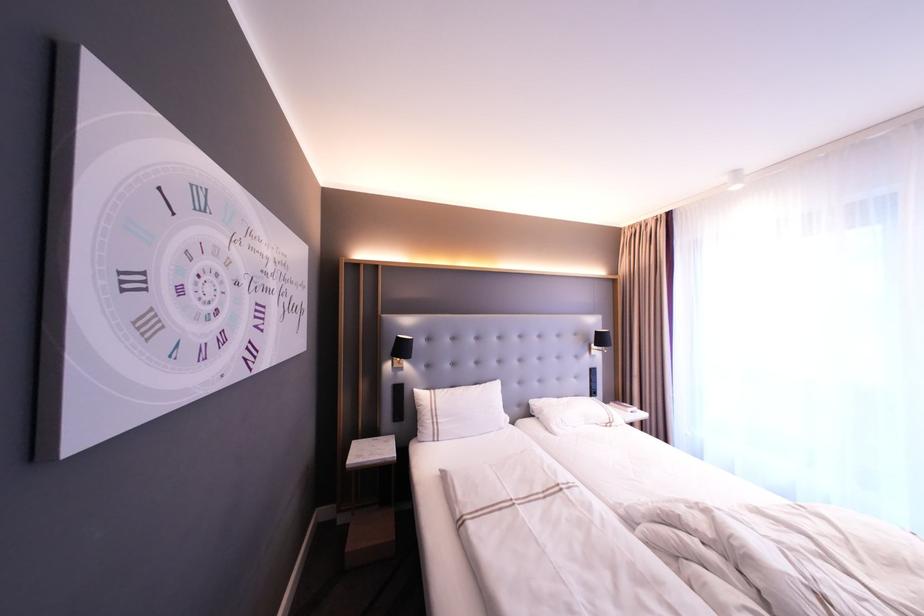
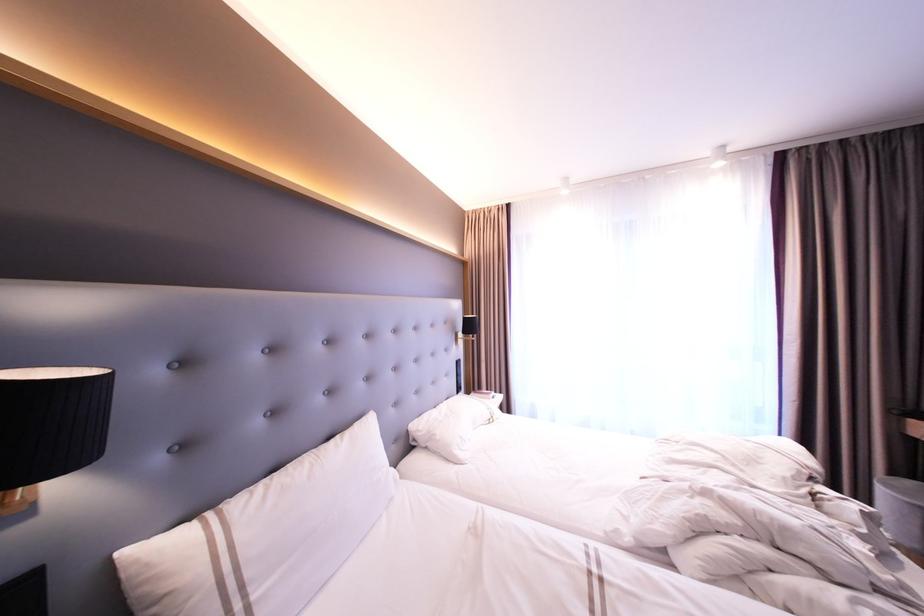
Find the pixel in the second image that matches point 546,428 in the first image.

(447, 460)